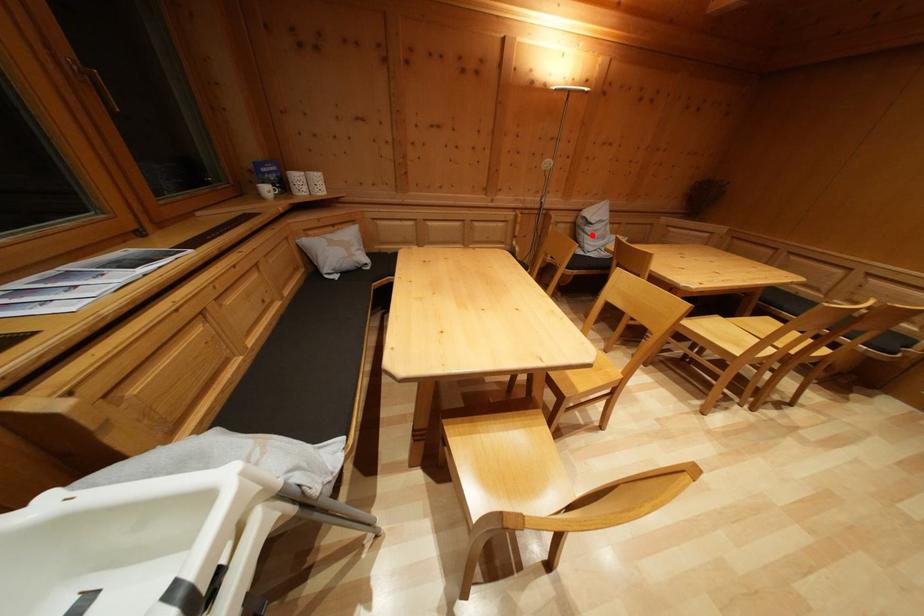
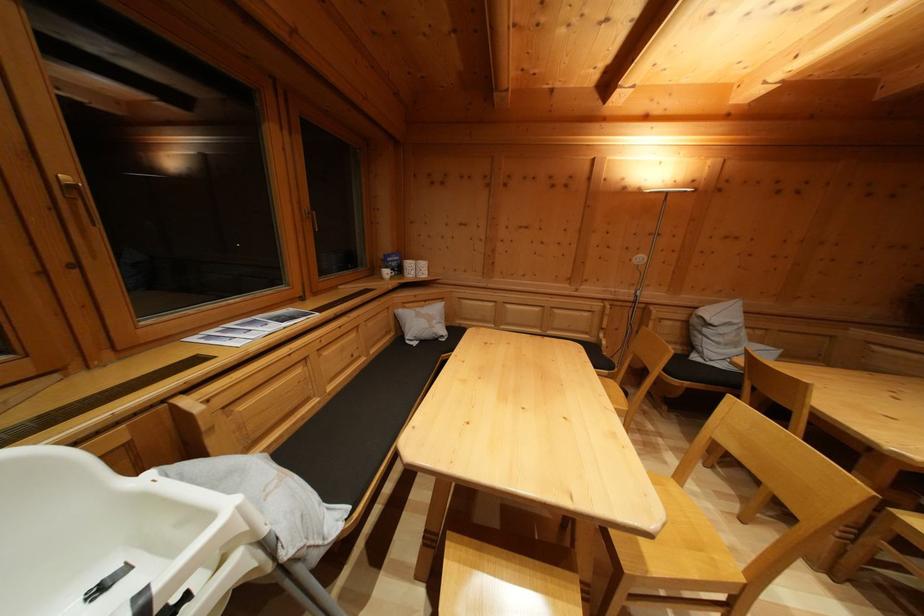
In the second image, find the point that corresponds to the highlighted location in the first image.

(711, 337)